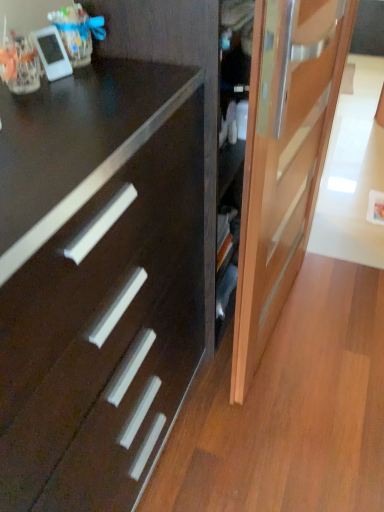
Question: Is light brown wooden door at right to the right of dark wood drawer at center from the viewer's perspective?

Choices:
 (A) no
 (B) yes

Answer: (B)

Question: Is light brown wooden door at right positioned in front of dark wood drawer at center?

Choices:
 (A) no
 (B) yes

Answer: (A)

Question: Is light brown wooden door at right outside of dark wood drawer at center?

Choices:
 (A) yes
 (B) no

Answer: (A)

Question: Does light brown wooden door at right have a greater width compared to dark wood drawer at center?

Choices:
 (A) no
 (B) yes

Answer: (A)

Question: Can you confirm if light brown wooden door at right is positioned to the left of dark wood drawer at center?

Choices:
 (A) no
 (B) yes

Answer: (A)

Question: Considering the relative sizes of light brown wooden door at right and dark wood drawer at center in the image provided, is light brown wooden door at right taller than dark wood drawer at center?

Choices:
 (A) no
 (B) yes

Answer: (B)

Question: Is dark wood drawer at center smaller than light brown wooden door at right?

Choices:
 (A) yes
 (B) no

Answer: (B)

Question: Is dark wood drawer at center not close to light brown wooden door at right?

Choices:
 (A) no
 (B) yes

Answer: (A)

Question: Considering the relative sizes of dark wood drawer at center and light brown wooden door at right in the image provided, is dark wood drawer at center thinner than light brown wooden door at right?

Choices:
 (A) no
 (B) yes

Answer: (A)

Question: From a real-world perspective, is dark wood drawer at center located higher than light brown wooden door at right?

Choices:
 (A) yes
 (B) no

Answer: (B)

Question: Does dark wood drawer at center appear on the right side of light brown wooden door at right?

Choices:
 (A) no
 (B) yes

Answer: (A)

Question: Is dark wood drawer at center taller than light brown wooden door at right?

Choices:
 (A) yes
 (B) no

Answer: (B)

Question: Is dark wood drawer at center taller or shorter than light brown wooden door at right?

Choices:
 (A) short
 (B) tall

Answer: (A)